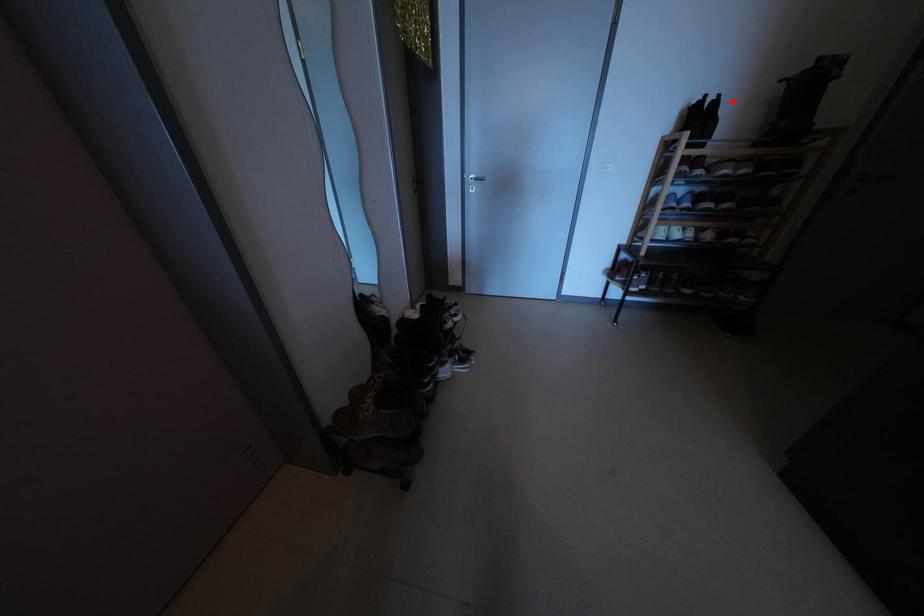
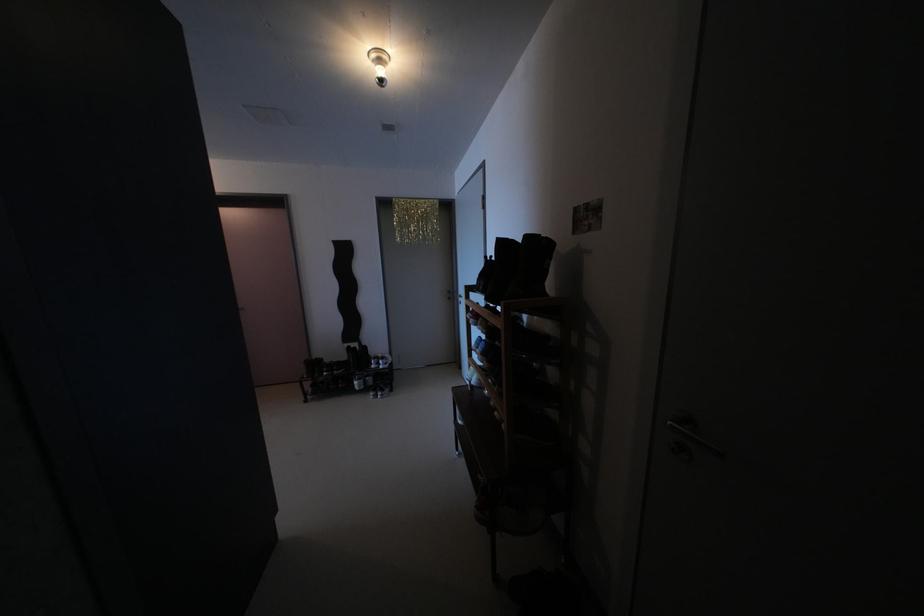
Where in the second image is the point corresponding to the highlighted location from the first image?

(504, 262)